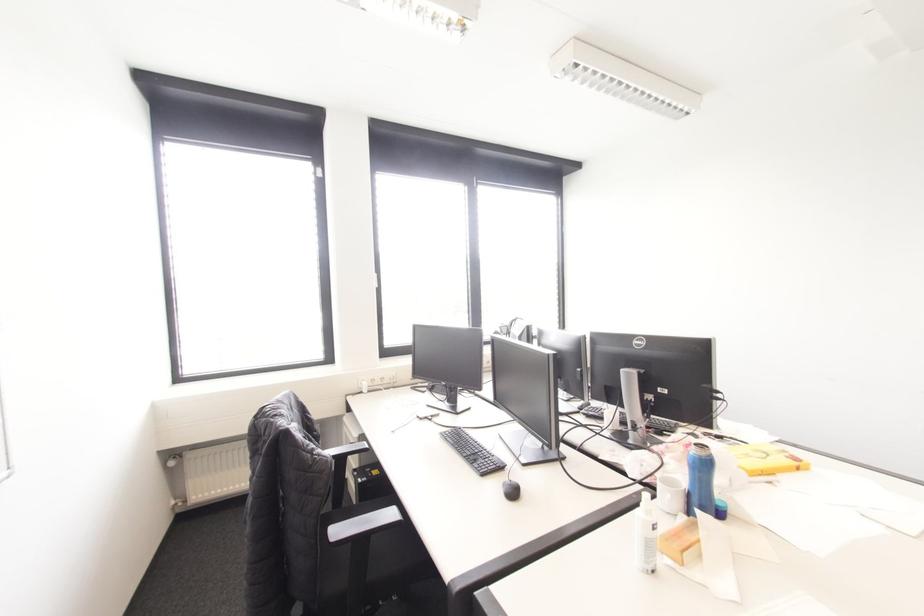
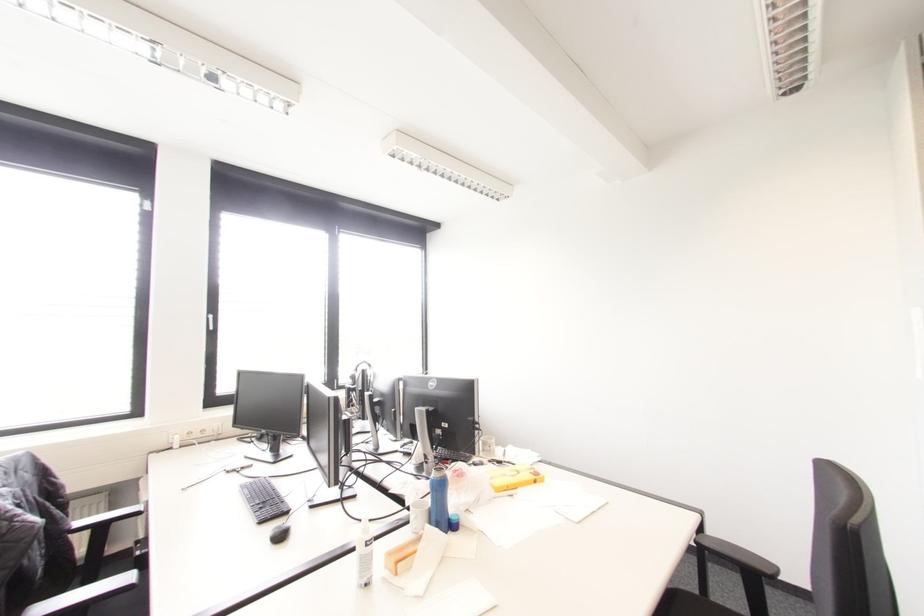
Find the pixel in the second image that matches (747,455) in the first image.

(504, 474)